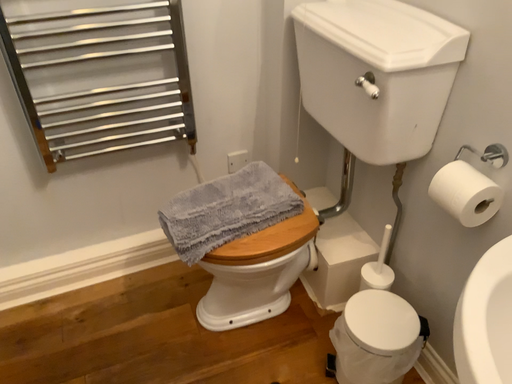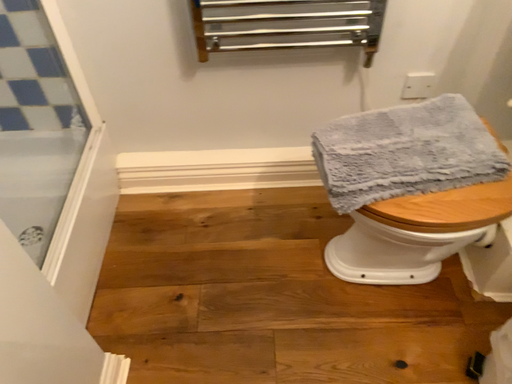
Question: Which way did the camera rotate in the video?

Choices:
 (A) rotated upward
 (B) rotated downward

Answer: (B)